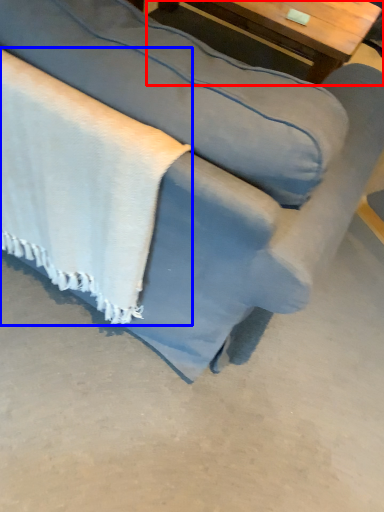
Question: Which object appears farthest to the camera in this image, table (highlighted by a red box) or blanket (highlighted by a blue box)?

Choices:
 (A) table
 (B) blanket

Answer: (A)